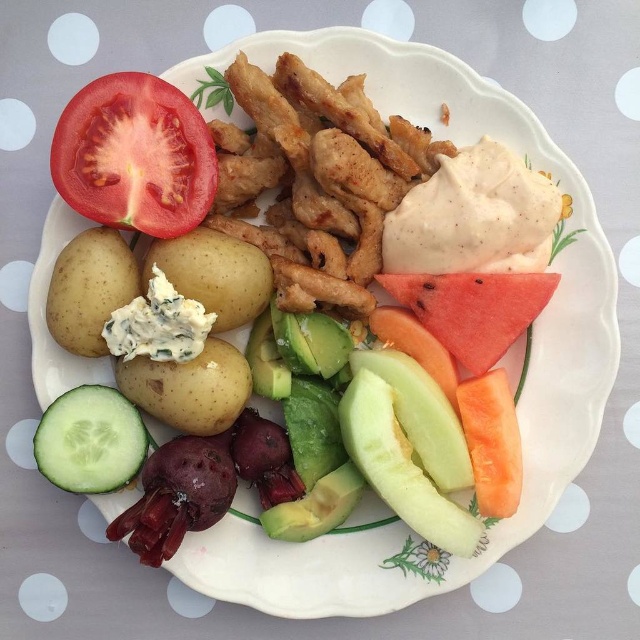
You are standing 5 feet away from the plate. Can you reach the point at coordinates point (x=554, y=276) on the plate?

The distance of point (x=554, y=276) from camera is 4.30 feet. Since you are standing 5 feet away from the plate, you can reach the point at coordinates point (x=554, y=276) on the plate because it is within your reach.

Looking at this image, you are a food stylist arranging a plate. You have a green smooth cucumber at lower left and a smooth yellow potato at lower left. Which of these two items is wider?

The green smooth cucumber at lower left is wider than the smooth yellow potato at lower left.